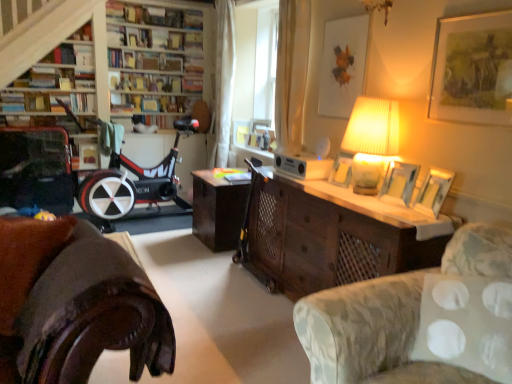
You are a GUI agent. You are given a task and a screenshot of the screen. Output one action in this format:
    pyautogui.click(x=<x>, y=<y>)
    Task: Click on the wooden picture frame at right, the third picture frame when ordered from front to back
    
    Given the screenshot: What is the action you would take?
    pyautogui.click(x=399, y=183)

What is the approximate width of white fabric pillow at lower right?

10.20 inches.

Identify the location of wooden desk at center. (323, 239).

This screenshot has width=512, height=384. What do you see at coordinates (323, 239) in the screenshot? I see `wooden desk at center` at bounding box center [323, 239].

The image size is (512, 384). I want to click on hardcover book at center, which is the fourth book from front to back, so click(153, 103).

Image resolution: width=512 pixels, height=384 pixels. Describe the element at coordinates (153, 103) in the screenshot. I see `hardcover book at center, which is the fourth book from front to back` at that location.

What do you see at coordinates (54, 39) in the screenshot? I see `wooden bookshelf at upper left` at bounding box center [54, 39].

You are a GUI agent. You are given a task and a screenshot of the screen. Output one action in this format:
    pyautogui.click(x=<x>, y=<y>)
    Task: Click on the wooden picture frame at right, the third picture frame when ordered from front to back
    The height and width of the screenshot is (384, 512).
    Given the screenshot: What is the action you would take?
    (399, 183)

Are white sheer curtain at upper center and wooden bookshelf at upper left far apart?

Absolutely, white sheer curtain at upper center is distant from wooden bookshelf at upper left.

Is white sheer curtain at upper center positioned with its back to wooden bookshelf at upper left?

No.

Between white sheer curtain at upper center and wooden bookshelf at upper left, which one has smaller size?

white sheer curtain at upper center.

Where is `curtain above the wooden bookshelf at upper left (from a real-world perspective)`? curtain above the wooden bookshelf at upper left (from a real-world perspective) is located at coordinates (223, 81).

Between wooden desk at center and matte black book at upper center, which appears as the 1th book when viewed from the back, which one appears on the left side from the viewer's perspective?

Positioned to the left is matte black book at upper center, which appears as the 1th book when viewed from the back.

Which point is more distant from viewer, [371,256] or [188,118]?

The point [188,118] is more distant.

Is wooden desk at center thinner than matte black book at upper center, which appears as the 1th book when viewed from the back?

No.

How distant is wooden desk at center from matte black book at upper center, which appears as the 1th book when viewed from the back?

wooden desk at center is 2.62 meters from matte black book at upper center, which appears as the 1th book when viewed from the back.

The height and width of the screenshot is (384, 512). Identify the location of the 4th picture frame positioned below the wooden bookshelf at upper left (from the image's perspective). (399, 183).

Is point (102, 45) farther from camera compared to point (404, 174)?

Yes, point (102, 45) is farther from viewer.

From the image's perspective, between wooden bookshelf at upper left and wooden picture frame at right, the third picture frame when ordered from front to back, who is located below?

wooden picture frame at right, the third picture frame when ordered from front to back, from the image's perspective.

Could you tell me if wooden bookshelf at upper left is turned towards wooden picture frame at right, marked as the 3th picture frame in a back-to-front arrangement?

Yes, wooden bookshelf at upper left is aimed at wooden picture frame at right, marked as the 3th picture frame in a back-to-front arrangement.

From the picture: Which object is further away from the camera taking this photo, hardcover book at upper left, the first book in the front-to-back sequence, or wooden table at center?

hardcover book at upper left, the first book in the front-to-back sequence.

Does hardcover book at upper left, which is counted as the fifth book, starting from the back, have a lesser height compared to wooden table at center?

Yes, hardcover book at upper left, which is counted as the fifth book, starting from the back, is shorter than wooden table at center.

From the image's perspective, would you say hardcover book at upper left, the first book in the front-to-back sequence, is positioned over wooden table at center?

Correct, hardcover book at upper left, the first book in the front-to-back sequence, appears higher than wooden table at center in the image.

Can you see hardcover book at upper left, which is counted as the fifth book, starting from the back, touching wooden table at center?

No, hardcover book at upper left, which is counted as the fifth book, starting from the back, is not next to wooden table at center.

From a real-world perspective, is velvet dark brown armchair at left located beneath gold-framed artwork at upper right, the 1th picture frame when ordered from front to back?

Correct, in the physical world, velvet dark brown armchair at left is lower than gold-framed artwork at upper right, the 1th picture frame when ordered from front to back.

Is velvet dark brown armchair at left located outside gold-framed artwork at upper right, marked as the fifth picture frame in a back-to-front arrangement?

Yes.

Is the surface of velvet dark brown armchair at left in direct contact with gold-framed artwork at upper right, the 1th picture frame when ordered from front to back?

No, velvet dark brown armchair at left is not making contact with gold-framed artwork at upper right, the 1th picture frame when ordered from front to back.

Considering the sizes of objects velvet dark brown armchair at left and gold-framed artwork at upper right, marked as the fifth picture frame in a back-to-front arrangement, in the image provided, who is shorter, velvet dark brown armchair at left or gold-framed artwork at upper right, marked as the fifth picture frame in a back-to-front arrangement,?

With less height is gold-framed artwork at upper right, marked as the fifth picture frame in a back-to-front arrangement.

What's the angular difference between wooden bookshelf at upper left and wooden picture frame at right, which is the 2th picture frame from front to back,'s facing directions?

wooden bookshelf at upper left and wooden picture frame at right, which is the 2th picture frame from front to back, are facing 102 degrees away from each other.

Is wooden bookshelf at upper left aimed at wooden picture frame at right, arranged as the fourth picture frame when viewed from the back?

Yes, wooden bookshelf at upper left is oriented towards wooden picture frame at right, arranged as the fourth picture frame when viewed from the back.

Is wooden bookshelf at upper left taller or shorter than wooden picture frame at right, which is the 2th picture frame from front to back?

In the image, wooden bookshelf at upper left appears to be taller than wooden picture frame at right, which is the 2th picture frame from front to back.

From the image's perspective, would you say wooden bookshelf at upper left is positioned over wooden picture frame at right, arranged as the fourth picture frame when viewed from the back?

Yes, from the image's perspective, wooden bookshelf at upper left is above wooden picture frame at right, arranged as the fourth picture frame when viewed from the back.

From a real-world perspective, which is physically below, hardcover book at upper left, the first book in the front-to-back sequence, or hardcover book at center, which is the fourth book from front to back?

hardcover book at upper left, the first book in the front-to-back sequence.

From the image's perspective, between hardcover book at upper left, the first book in the front-to-back sequence, and hardcover book at center, which is the fourth book from front to back, who is located below?

hardcover book at upper left, the first book in the front-to-back sequence, from the image's perspective.

Considering the points (8, 102) and (112, 96), which point is in front, point (8, 102) or point (112, 96)?

Point (8, 102)

Is hardcover book at upper left, the first book in the front-to-back sequence, positioned far away from hardcover book at center, which is the fourth book from front to back?

Yes, hardcover book at upper left, the first book in the front-to-back sequence, is far from hardcover book at center, which is the fourth book from front to back.

I want to click on curtain behind the wooden bookshelf at upper left, so click(x=223, y=81).

The height and width of the screenshot is (384, 512). I want to click on desk below the matte black book at upper center, the fifth book viewed from the front (from a real-world perspective), so click(x=323, y=239).

Estimate the real-world distances between objects in this image. Which object is closer to wooden picture frame at right, marked as the 3th picture frame in a back-to-front arrangement, wooden desk at center or white fabric pillow at lower right?

wooden desk at center.

From the image, which object appears to be nearer to floral fabric sofa at lower right, the first studio couch positioned from the right, matte black book at upper center, which appears as the 1th book when viewed from the back, or white sheer curtain at upper center?

Among the two, white sheer curtain at upper center is located nearer to floral fabric sofa at lower right, the first studio couch positioned from the right.

Considering their positions, is floral fabric sofa at lower right, the first studio couch positioned from the right, positioned further to wooden desk at center than wooden table at center?

floral fabric sofa at lower right, the first studio couch positioned from the right, lies further to wooden desk at center than the other object.

From the image, which object appears to be farther from hardcover book at upper center, marked as the 3th book in a front-to-back arrangement, hardcover book at upper left, which ranks as the second book in front-to-back order, or hardcover book at upper left, the first book in the front-to-back sequence?

Based on the image, hardcover book at upper left, the first book in the front-to-back sequence, appears to be further to hardcover book at upper center, marked as the 3th book in a front-to-back arrangement.

Which object lies further to the anchor point brown leather couch at lower left, acting as the first studio couch starting from the left, white fabric pillow at lower right or matte black book at upper center, which appears as the 1th book when viewed from the back?

matte black book at upper center, which appears as the 1th book when viewed from the back, is positioned further to the anchor brown leather couch at lower left, acting as the first studio couch starting from the left.

Which object lies nearer to the anchor point wooden picture frame at right, the third picture frame when ordered from front to back, white fabric pillow at lower right or floral fabric sofa at lower right, the first studio couch positioned from the right?

Based on the image, floral fabric sofa at lower right, the first studio couch positioned from the right, appears to be nearer to wooden picture frame at right, the third picture frame when ordered from front to back.

Looking at the image, which one is located further to gold-framed artwork at upper right, the 1th picture frame when ordered from front to back, matte black book at upper center, which appears as the 1th book when viewed from the back, or white fabric pillow at lower right?

Among the two, matte black book at upper center, which appears as the 1th book when viewed from the back, is located further to gold-framed artwork at upper right, the 1th picture frame when ordered from front to back.

Based on their spatial positions, is floral fabric sofa at lower right, the first studio couch positioned from the right, or hardcover book at center, the 2th book from the back, further from wooden table at center?

floral fabric sofa at lower right, the first studio couch positioned from the right.

What are the coordinates of `table lamp between gold-framed artwork at upper right, the 1th picture frame when ordered from front to back, and wooden desk at center, in the vertical direction` in the screenshot? It's located at (371, 140).

You are a GUI agent. You are given a task and a screenshot of the screen. Output one action in this format:
    pyautogui.click(x=<x>, y=<y>)
    Task: Click on the table positioned between wooden picture frame at center, marked as the 4th picture frame in a front-to-back arrangement, and hardcover book at upper center, positioned as the third book in back-to-front order, from near to far
    This screenshot has height=384, width=512.
    Given the screenshot: What is the action you would take?
    pyautogui.click(x=217, y=210)

This screenshot has width=512, height=384. Identify the location of table lamp between wooden picture frame at right, marked as the 3th picture frame in a back-to-front arrangement, and hardcover book at center, which is the fourth book from front to back, in the front-back direction. (371, 140).

Identify the location of bookcase between hardcover book at upper left, which ranks as the second book in front-to-back order, and wooden picture frame at center, marked as the 4th picture frame in a front-to-back arrangement. (54, 39).